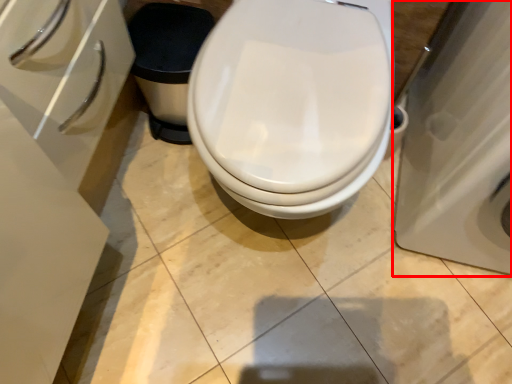
Question: From the image's perspective, considering the relative positions of porcelain (annotated by the red box) and toilet in the image provided, where is porcelain (annotated by the red box) located with respect to the staircase?

Choices:
 (A) below
 (B) above

Answer: (B)